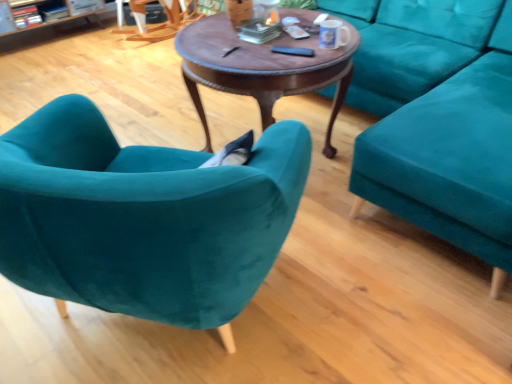
You are a GUI agent. You are given a task and a screenshot of the screen. Output one action in this format:
    pyautogui.click(x=<x>, y=<y>)
    Task: Click on the free location in front of wooden rocking chair at upper left
    
    Given the screenshot: What is the action you would take?
    pyautogui.click(x=129, y=60)